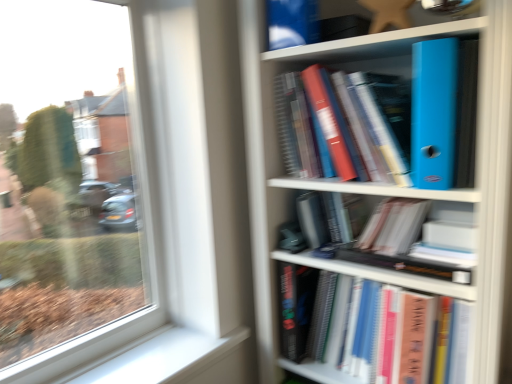
I want to click on free space above white smooth window sill at lower left (from a real-world perspective), so click(145, 356).